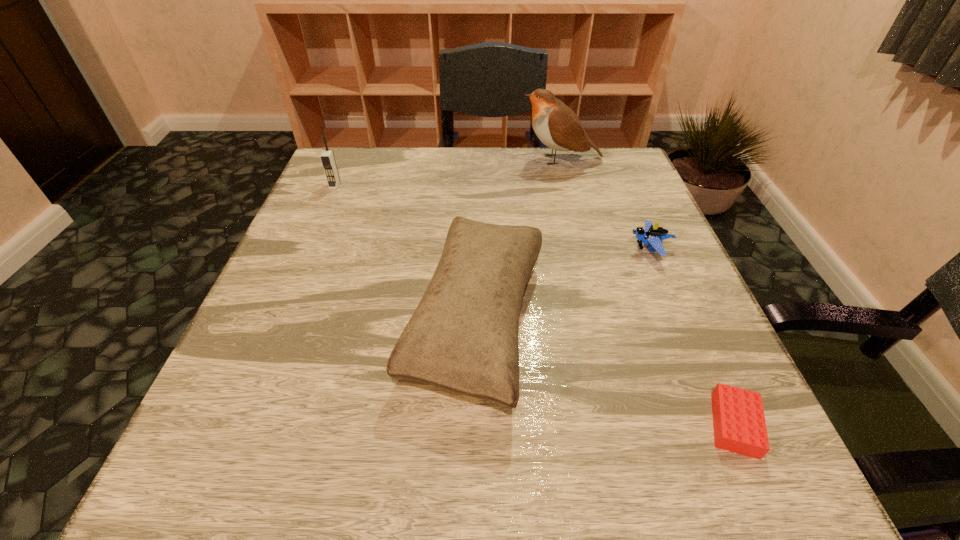
Where is `empty space between the farthest object and the taller Lego`? empty space between the farthest object and the taller Lego is located at coordinates click(606, 204).

Locate an element on the screen. free space between the nearer Lego and the cellular telephone is located at coordinates (535, 305).

Find the location of a particular element. This screenshot has height=540, width=960. the third closest object to the cushion is located at coordinates (557, 126).

Select which object is the fourth closest to the third tallest object. Please provide its 2D coordinates. Your answer should be formatted as a tuple, i.e. [(x, y)], where the tuple contains the x and y coordinates of a point satisfying the conditions above.

[(327, 157)]

Where is `vacant space that satisfies the following two spatial constraints: 1. at the face of the shorter Lego; 2. on the left side of the tallest object`? vacant space that satisfies the following two spatial constraints: 1. at the face of the shorter Lego; 2. on the left side of the tallest object is located at coordinates pyautogui.click(x=630, y=425).

Image resolution: width=960 pixels, height=540 pixels. Identify the location of vacant area in the image that satisfies the following two spatial constraints: 1. on the front-facing side of the leftmost object; 2. on the left side of the shortest object. (231, 425).

Image resolution: width=960 pixels, height=540 pixels. I want to click on free space that satisfies the following two spatial constraints: 1. at the face of the tallest object; 2. on the front-facing side of the leftmost object, so click(567, 186).

The height and width of the screenshot is (540, 960). In order to click on blank area in the image that satisfies the following two spatial constraints: 1. on the front-facing side of the cellular telephone; 2. on the left side of the third shortest object in this screenshot , I will do `click(276, 320)`.

What are the coordinates of `vacant area that satisfies the following two spatial constraints: 1. at the face of the shortest object; 2. on the left side of the tallest object` in the screenshot? It's located at (630, 425).

Identify the location of vacant region that satisfies the following two spatial constraints: 1. at the face of the bird; 2. on the front-facing side of the cellular telephone. (567, 186).